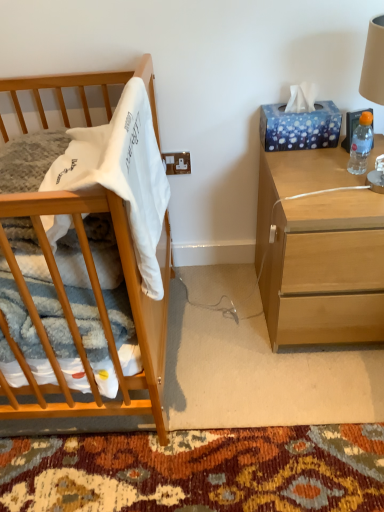
Locate an element on the screen. Image resolution: width=384 pixels, height=512 pixels. unoccupied area in front of light wood nightstand at right is located at coordinates (306, 407).